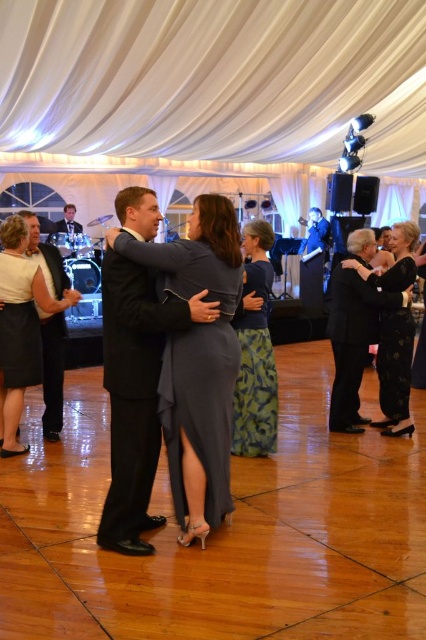
Question: Does satin gray dress at center have a smaller size compared to black satin dress at lower left?

Choices:
 (A) no
 (B) yes

Answer: (A)

Question: Can you confirm if black satin dress at lower left is positioned below brushed metal microphone at upper center?

Choices:
 (A) yes
 (B) no

Answer: (A)

Question: Which of the following is the farthest from the observer?

Choices:
 (A) satin gray dress at center
 (B) black floral dress at right
 (C) green textured dress at center

Answer: (B)

Question: Among these points, which one is nearest to the camera?

Choices:
 (A) (414, 262)
 (B) (118, 307)
 (C) (230, 346)

Answer: (B)

Question: Is matte white dress at left further to camera compared to black satin dress at lower left?

Choices:
 (A) yes
 (B) no

Answer: (B)

Question: Which object is farther from the camera taking this photo?

Choices:
 (A) green textured dress at center
 (B) black satin dress at lower left
 (C) black satin dress at right
 (D) brushed metal microphone at upper center

Answer: (D)